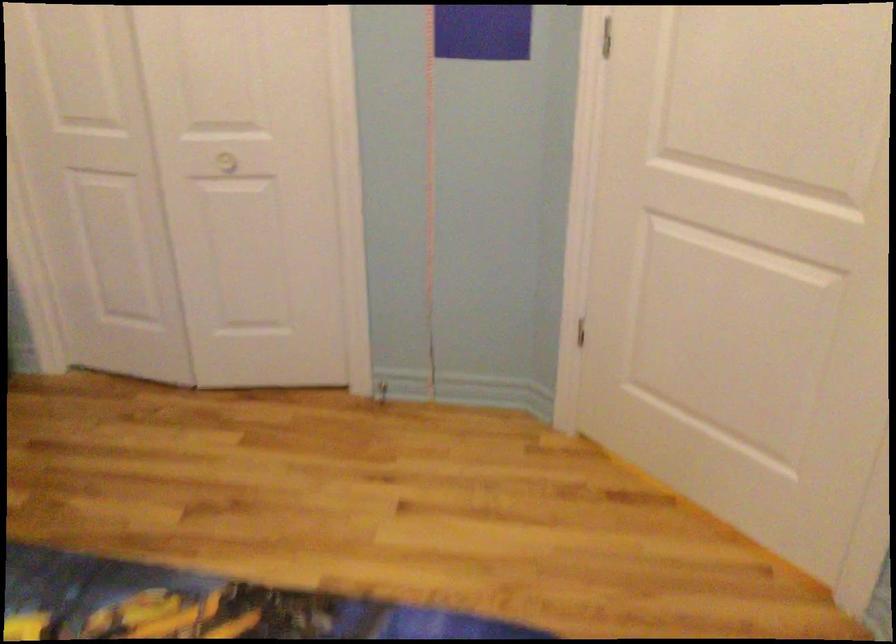
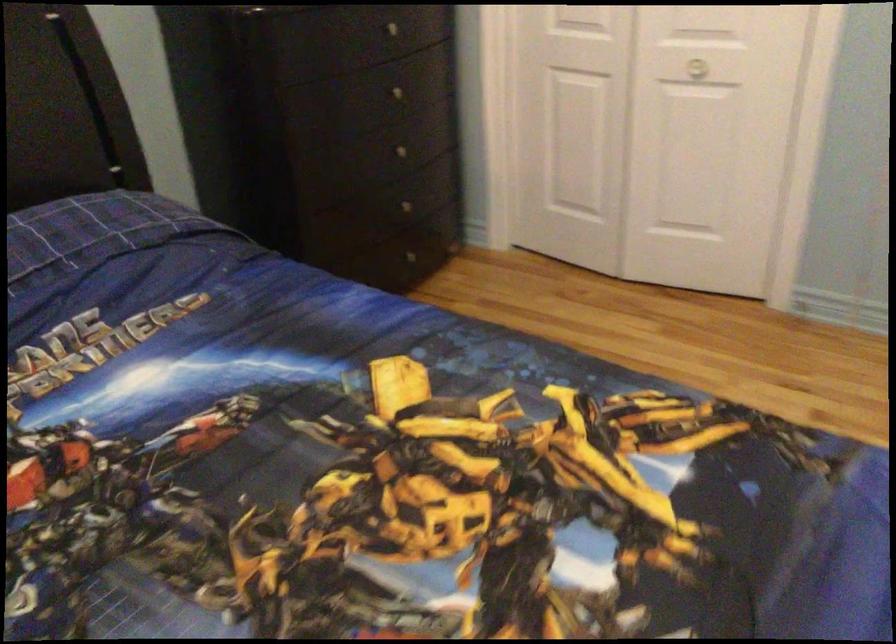
What movement of the cameraman would produce the second image?

The movement direction of the cameraman is left, backward.